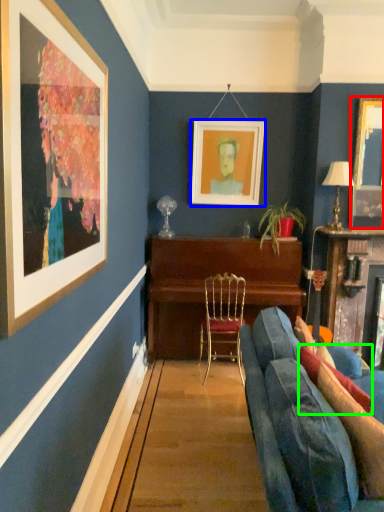
Question: Based on their relative distances, which object is nearer to picture frame (highlighted by a red box)? Choose from picture frame (highlighted by a blue box) and pillow (highlighted by a green box).

Choices:
 (A) picture frame
 (B) pillow

Answer: (A)